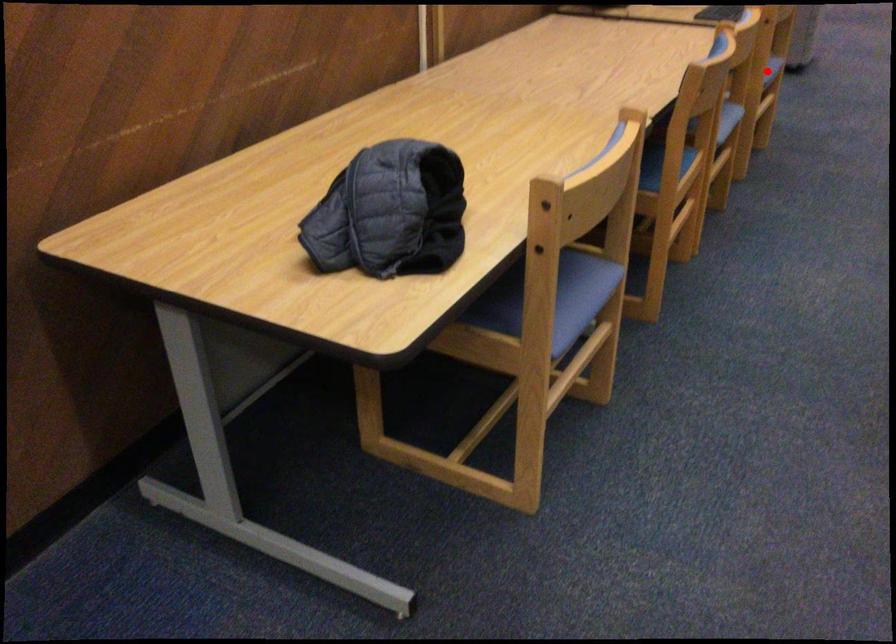
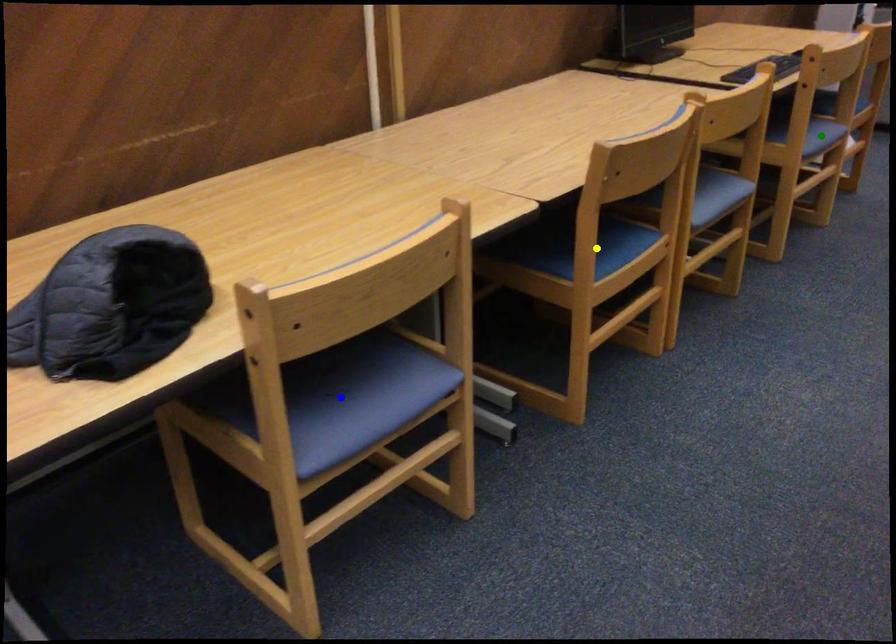
Question: I am providing you with two images of the same scene from different viewpoints. A red point is marked on the first image. You are given multiple points on the second image. In image 2, which mark is for the same physical point as the one in image 1?

Choices:
 (A) green point
 (B) blue point
 (C) yellow point

Answer: (A)